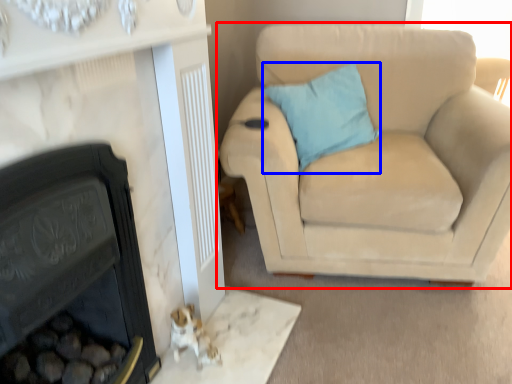
Question: Which object appears farthest to the camera in this image, studio couch (highlighted by a red box) or pillow (highlighted by a blue box)?

Choices:
 (A) studio couch
 (B) pillow

Answer: (B)